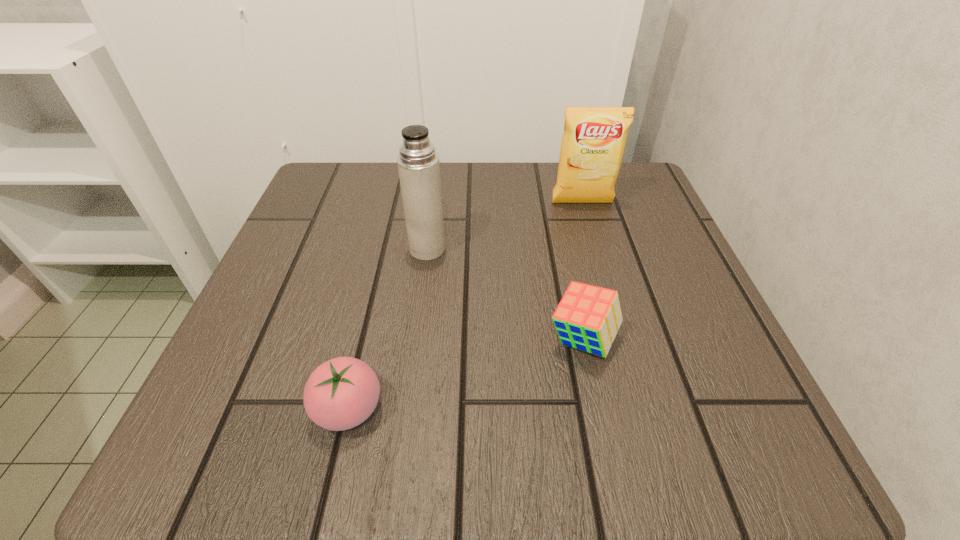
At what (x,y) coordinates should I click in order to perform the action: click on vacant space at the far right corner of the desktop. Please return your answer as a coordinate pair (x, y). This screenshot has height=540, width=960. Looking at the image, I should click on (619, 210).

You are a GUI agent. You are given a task and a screenshot of the screen. Output one action in this format:
    pyautogui.click(x=<x>, y=<y>)
    Task: Click on the free area in between the cube and the tomato
    
    Given the screenshot: What is the action you would take?
    pyautogui.click(x=466, y=374)

Find the location of `free area in between the tomato and the third nearest object`. free area in between the tomato and the third nearest object is located at coordinates (388, 329).

You are a GUI agent. You are given a task and a screenshot of the screen. Output one action in this format:
    pyautogui.click(x=<x>, y=<y>)
    Task: Click on the vacant area that lies between the crisp (potato chip) and the cube
    The image size is (960, 540).
    Given the screenshot: What is the action you would take?
    (x=583, y=272)

Identify the location of unoccupied area between the tomato and the second farthest object. (388, 329).

Locate an element on the screen. This screenshot has width=960, height=540. free spot between the third nearest object and the nearest object is located at coordinates (388, 329).

Find the location of a particular element. The width and height of the screenshot is (960, 540). free area in between the second farthest object and the cube is located at coordinates (505, 294).

Locate an element on the screen. vacant point located between the third farthest object and the crisp (potato chip) is located at coordinates (583, 272).

Locate an element on the screen. This screenshot has height=540, width=960. vacant area that lies between the nearest object and the second nearest object is located at coordinates (466, 374).

This screenshot has height=540, width=960. Identify the location of vacant point located between the third nearest object and the crisp (potato chip). (505, 226).